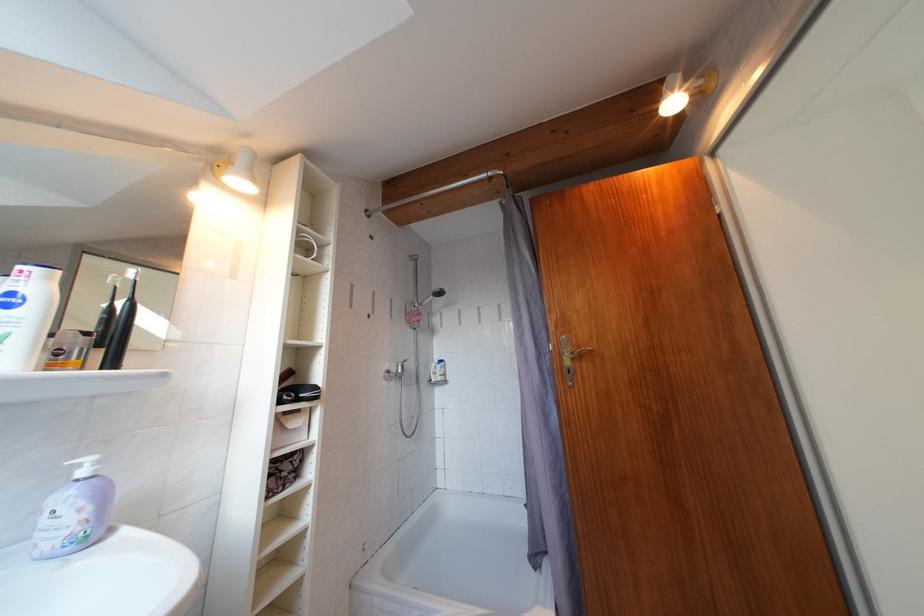
This screenshot has height=616, width=924. I want to click on brass door handle, so click(569, 358).